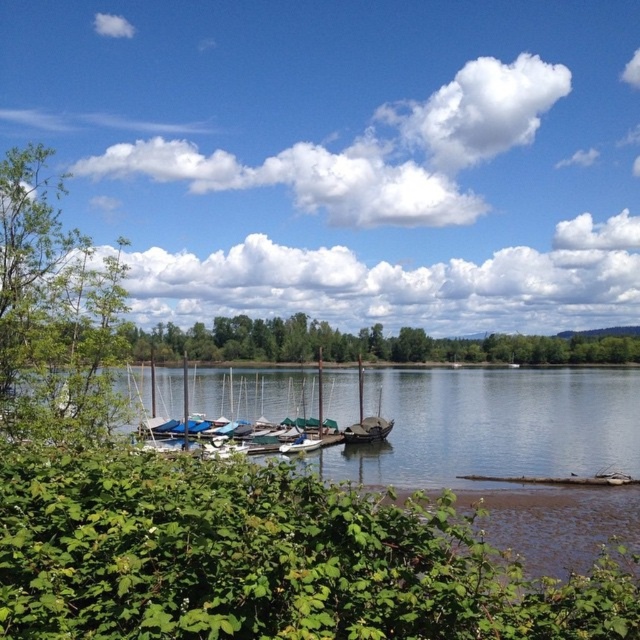
You are standing at the lakeside and want to reach a specific point marked at coordinates point [28,195]. If your walking speed is 1.5 meters per second, how many seconds will it take you to reach that point?

The distance of point [28,195] from viewer is 10.74 meters. At a speed of 1.5 meters per second, it will take approximately 7.16 seconds to reach the point.

You are planning to take a photo of the dark brown wooden sailboat at center from the green leafy tree at left. Since the tree is closer to you, will it block your view of the sailboat?

The green leafy tree at left is smaller than the dark brown wooden sailboat at center, so the tree won not block the view of the sailboat because it is shorter.

You are a photographer standing at the lakeside and want to capture both the green leafy tree at left and the dark brown wooden sailboat at center in the same frame. The camera you are using has a maximum focal length that allows capturing objects up to 30 meters apart. Will you be able to include both objects in a single photo?

The green leafy tree at left and dark brown wooden sailboat at center are 30.40 meters apart from each other. Since the maximum focal length allows capturing objects up to 30 meters apart, the distance between them exceeds this limit by 0.40 meters. Therefore, you will not be able to include both objects in a single photo.